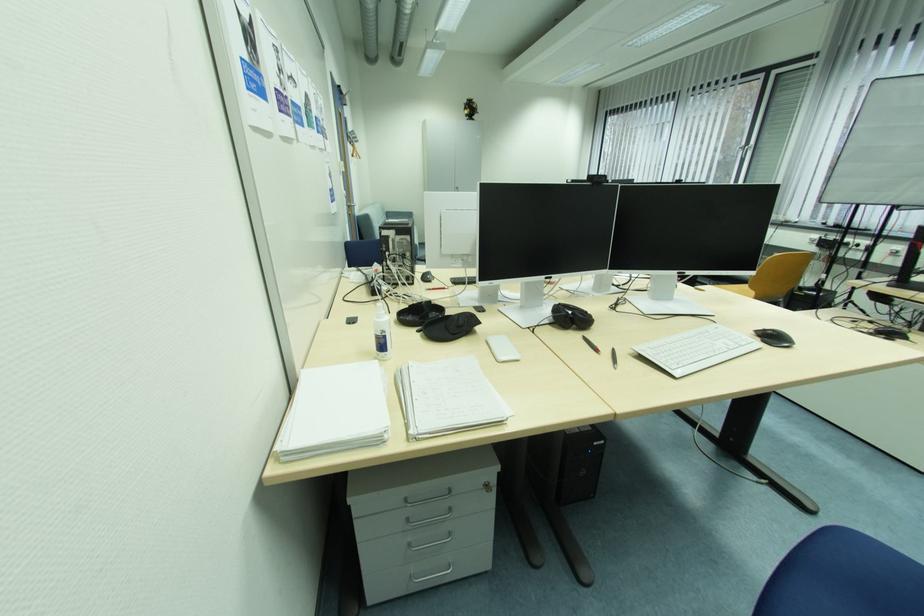
This screenshot has width=924, height=616. Describe the element at coordinates (382, 333) in the screenshot. I see `the bottle pump` at that location.